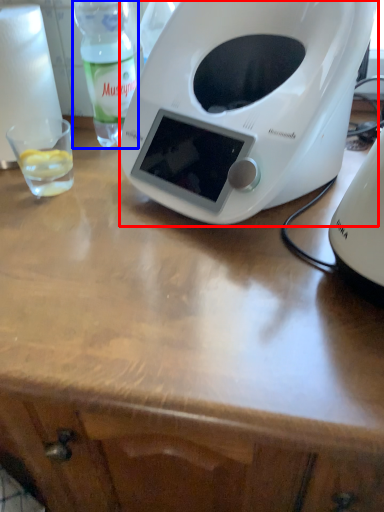
Question: Which of the following is the closest to the observer, toaster (highlighted by a red box) or bottle (highlighted by a blue box)?

Choices:
 (A) toaster
 (B) bottle

Answer: (A)